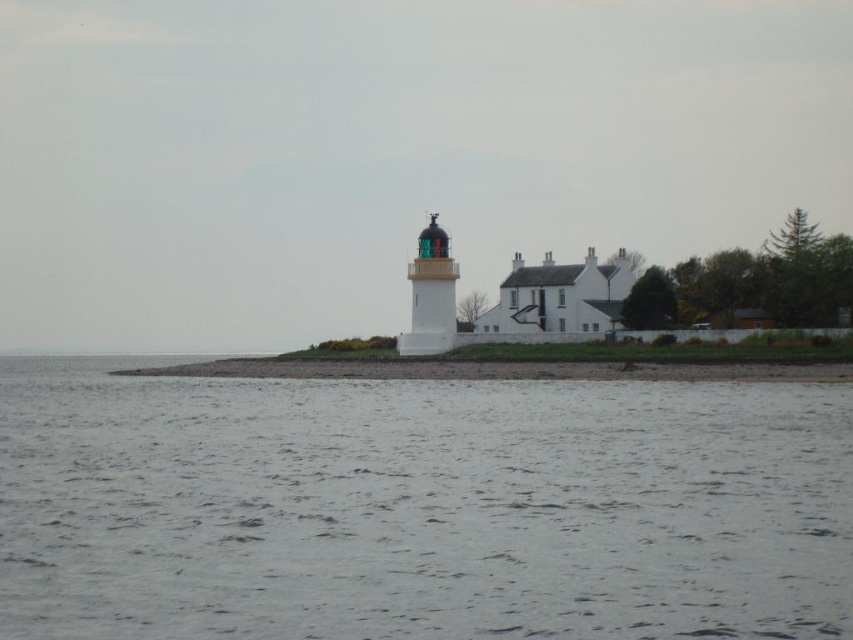
You are a photographer planning to capture the lighthouse and the water in the scene. Given that the gray water at lower center and the white painted brick lighthouse at center are both in your shot, which one will occupy more of the frame?

The gray water at lower center occupies more of the frame because it is larger in size than the white painted brick lighthouse at center.

You are standing on the smooth sand at lower center and want to reach the lighthouse. Which direction should you move to avoid stepping into the gray water at lower center?

Since the gray water at lower center is below the smooth sand at lower center, you should move upward away from the gray water at lower center to reach the lighthouse without stepping into the water.

You are standing at the lighthouse and want to walk to the point marked at coordinates point (x=496, y=369). Based on the scene description, what type of terrain will you encounter along the way?

The point (x=496, y=369) is on smooth sand at lower center, so the terrain you will encounter along the way is smooth sand.